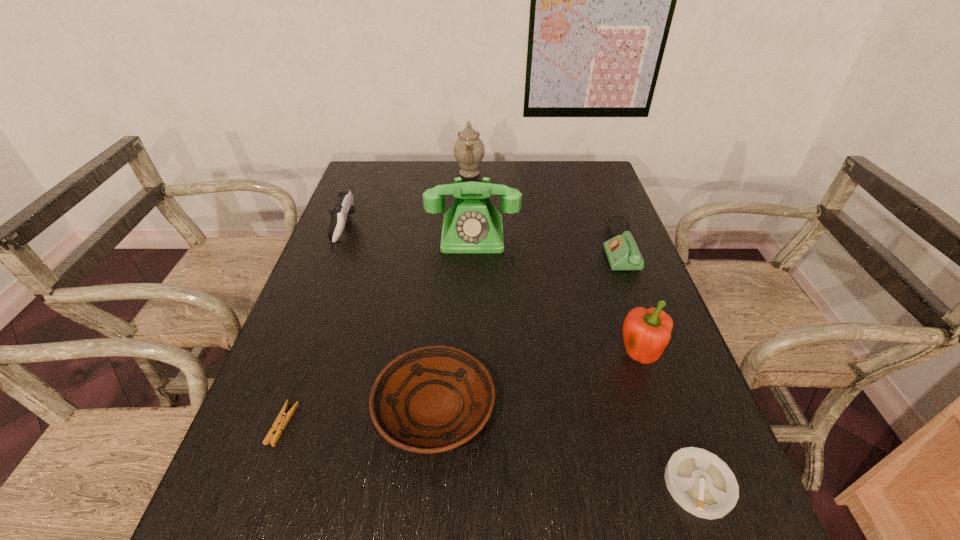
Locate an element on the screen. The width and height of the screenshot is (960, 540). control that is at the left edge is located at coordinates (344, 207).

At what (x,y) coordinates should I click in order to perform the action: click on clothespin that is at the left edge. Please return your answer as a coordinate pair (x, y). The height and width of the screenshot is (540, 960). Looking at the image, I should click on (282, 419).

This screenshot has width=960, height=540. In order to click on pepper located at the right edge in this screenshot , I will do `click(646, 332)`.

You are a GUI agent. You are given a task and a screenshot of the screen. Output one action in this format:
    pyautogui.click(x=<x>, y=<y>)
    Task: Click on the telephone located at the right edge
    This screenshot has width=960, height=540.
    Given the screenshot: What is the action you would take?
    pyautogui.click(x=622, y=252)

Locate an element on the screen. The image size is (960, 540). ashtray present at the right edge is located at coordinates (700, 482).

This screenshot has width=960, height=540. Identify the location of free location at the far edge. (407, 182).

The width and height of the screenshot is (960, 540). I want to click on free region at the left edge of the desktop, so click(317, 293).

The height and width of the screenshot is (540, 960). I want to click on vacant area at the right edge, so click(x=619, y=345).

Find the location of `vacant region between the clothespin and the chinaware`. vacant region between the clothespin and the chinaware is located at coordinates (376, 299).

What are the coordinates of `vacant point located between the chinaware and the plate` in the screenshot? It's located at (452, 291).